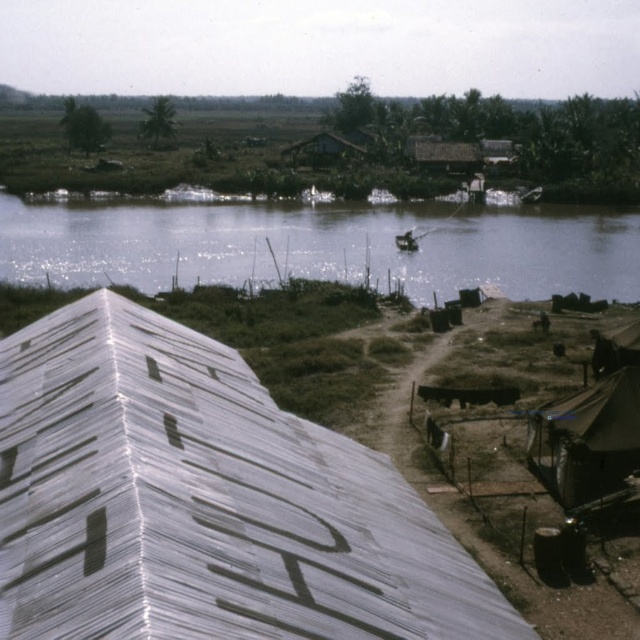
Based on the photo, can you confirm if clear water at center is shorter than dark brown canvas tent at lower right?

No, clear water at center is not shorter than dark brown canvas tent at lower right.

Image resolution: width=640 pixels, height=640 pixels. Describe the element at coordinates (323, 244) in the screenshot. I see `clear water at center` at that location.

The width and height of the screenshot is (640, 640). Describe the element at coordinates (323, 244) in the screenshot. I see `clear water at center` at that location.

Image resolution: width=640 pixels, height=640 pixels. I want to click on clear water at center, so click(323, 244).

The height and width of the screenshot is (640, 640). What do you see at coordinates (204, 500) in the screenshot?
I see `metallic corrugated roof at upper left` at bounding box center [204, 500].

Which is in front, point (84, 611) or point (596, 429)?

Positioned in front is point (84, 611).

Locate an element on the screen. The width and height of the screenshot is (640, 640). metallic corrugated roof at upper left is located at coordinates (204, 500).

Can you confirm if metallic corrugated roof at upper left is taller than clear water at center?

No.

Between metallic corrugated roof at upper left and clear water at center, which one has less height?

With less height is metallic corrugated roof at upper left.

This screenshot has height=640, width=640. I want to click on metallic corrugated roof at upper left, so click(x=204, y=500).